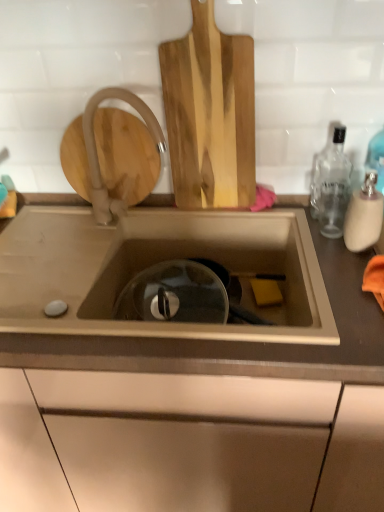
Locate an element on the screen. Image resolution: width=384 pixels, height=512 pixels. vacant area that is in front of matte white faucet at upper left is located at coordinates (75, 238).